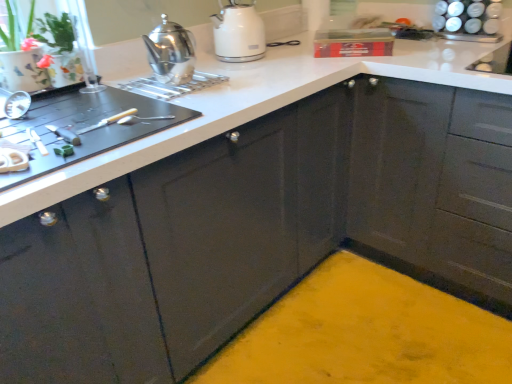
Question: Considering the positions of white glossy spice rack at upper right and black rubber cutting board at left in the image, is white glossy spice rack at upper right taller or shorter than black rubber cutting board at left?

Choices:
 (A) tall
 (B) short

Answer: (A)

Question: Is white glossy spice rack at upper right in front of or behind black rubber cutting board at left in the image?

Choices:
 (A) behind
 (B) front

Answer: (A)

Question: Which object is positioned closest to the textured ceramic pot at upper left?

Choices:
 (A) glossy dark gray cabinet at upper right
 (B) white glossy spice rack at upper right
 (C) white glossy countertop at center
 (D) white glossy kettle at upper center, which is counted as the second kitchen appliance, starting from the left
 (E) polished stainless steel teapot at upper left, arranged as the first kitchen appliance when viewed from the front

Answer: (E)

Question: Estimate the real-world distances between objects in this image. Which object is closer to the glossy dark gray cabinet at upper right?

Choices:
 (A) black rubber cutting board at left
 (B) white glossy spice rack at upper right
 (C) textured ceramic pot at upper left
 (D) white glossy countertop at center
 (E) polished stainless steel teapot at upper left, which appears as the 1th kitchen appliance when viewed from the left

Answer: (D)